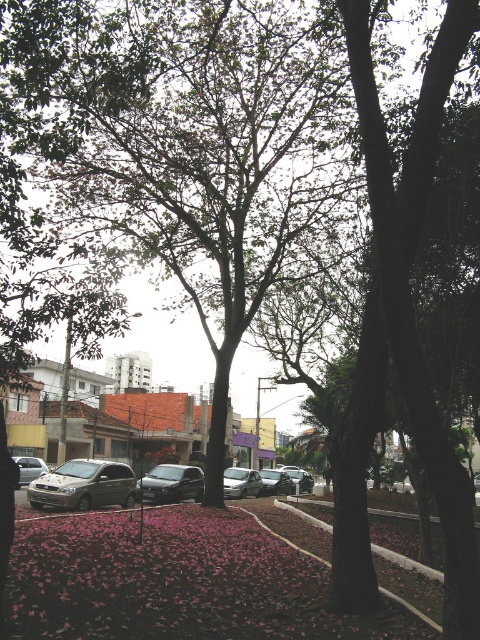
Who is taller, pink matte petals at lower center or metallic silver sedan at center?

pink matte petals at lower center is taller.

Does pink matte petals at lower center have a greater height compared to metallic silver sedan at center?

Indeed, pink matte petals at lower center has a greater height compared to metallic silver sedan at center.

Which is behind, point (33, 588) or point (299, 477)?

The point (299, 477) is behind.

Where is `pink matte petals at lower center`? pink matte petals at lower center is located at coordinates (176, 582).

Between point (252, 492) and point (259, 472), which one is positioned behind?

The point (259, 472) is more distant.

Is point (261, 483) behind point (273, 472)?

No, (261, 483) is in front of (273, 472).

Identify the location of satin silver car at center. The width and height of the screenshot is (480, 640). (241, 483).

The height and width of the screenshot is (640, 480). I want to click on satin black car at center, so click(x=170, y=483).

Who is positioned more to the left, satin black car at center or metallic silver sedan at center?

satin black car at center

What do you see at coordinates (170, 483) in the screenshot? The width and height of the screenshot is (480, 640). I see `satin black car at center` at bounding box center [170, 483].

Find the location of a particular element. This screenshot has width=480, height=640. satin black car at center is located at coordinates (170, 483).